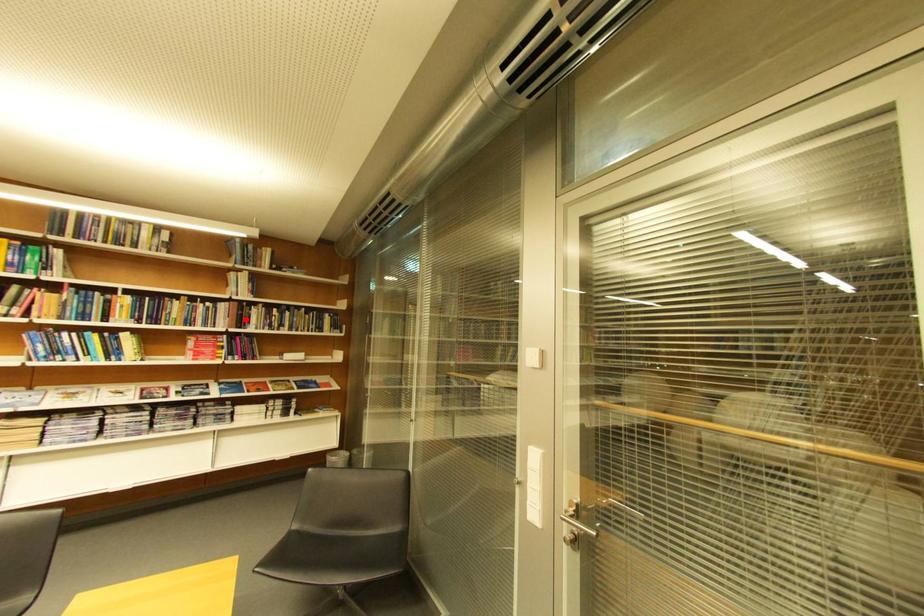
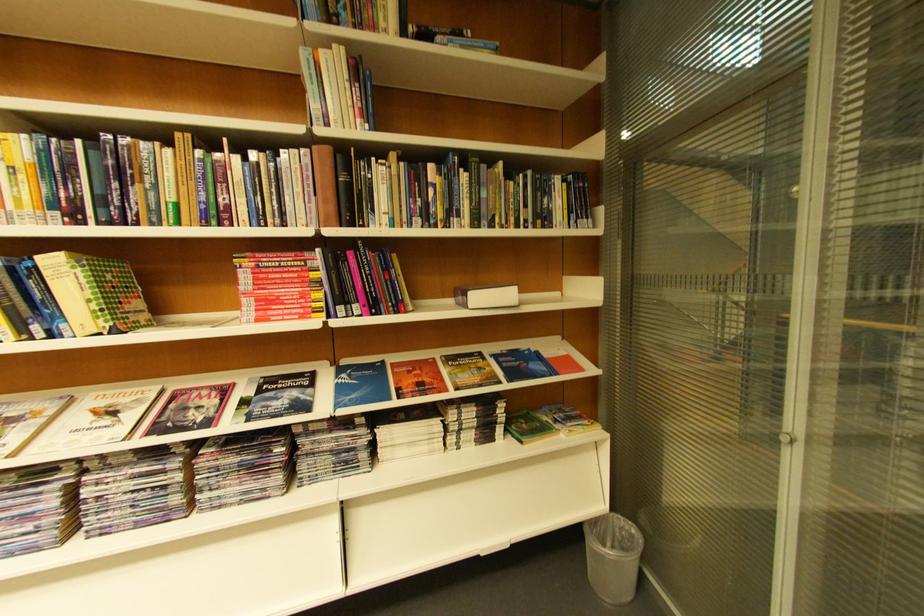
Find the pixel in the second image that matches the highlighted location in the first image.

(342, 196)